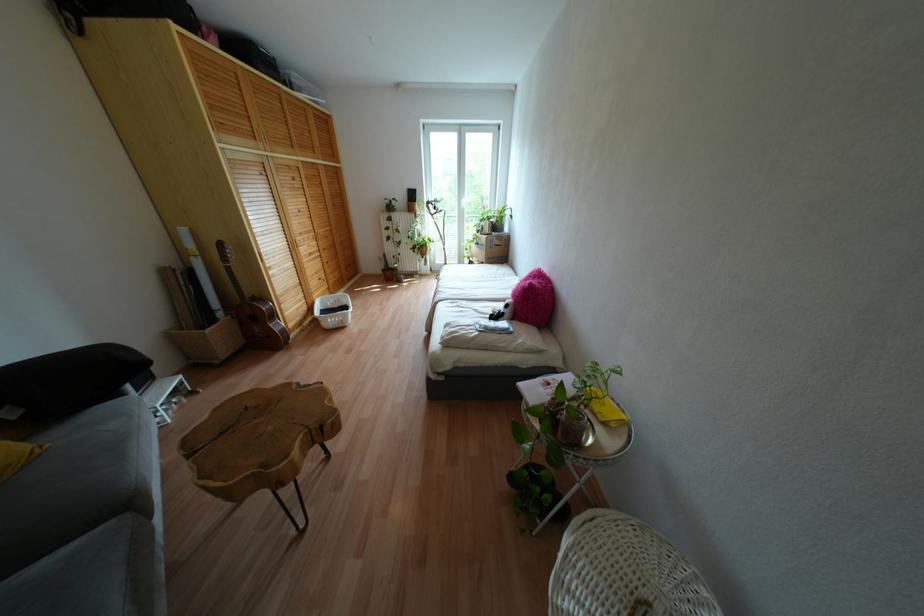
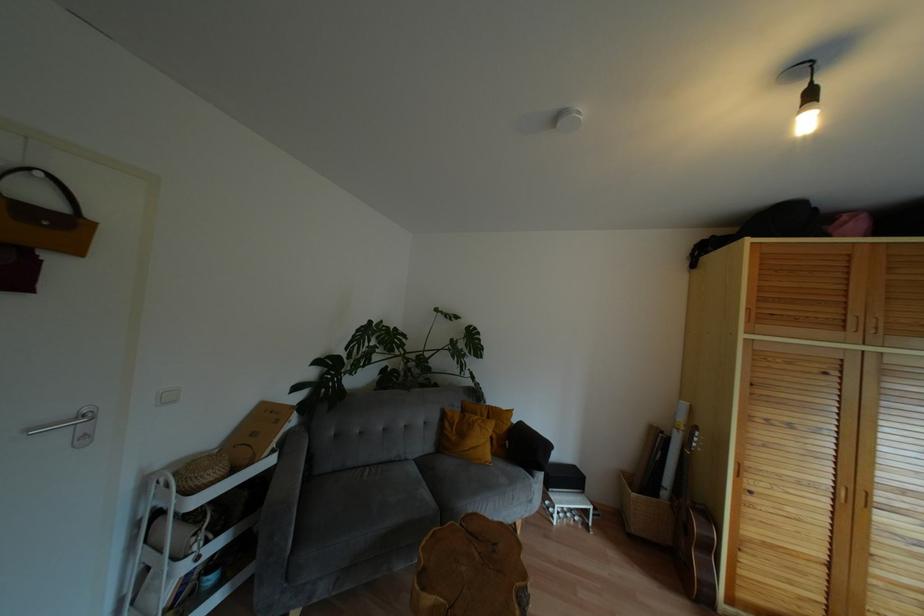
The point at (273, 314) is marked in the first image. Where is the corresponding point in the second image?

(710, 548)